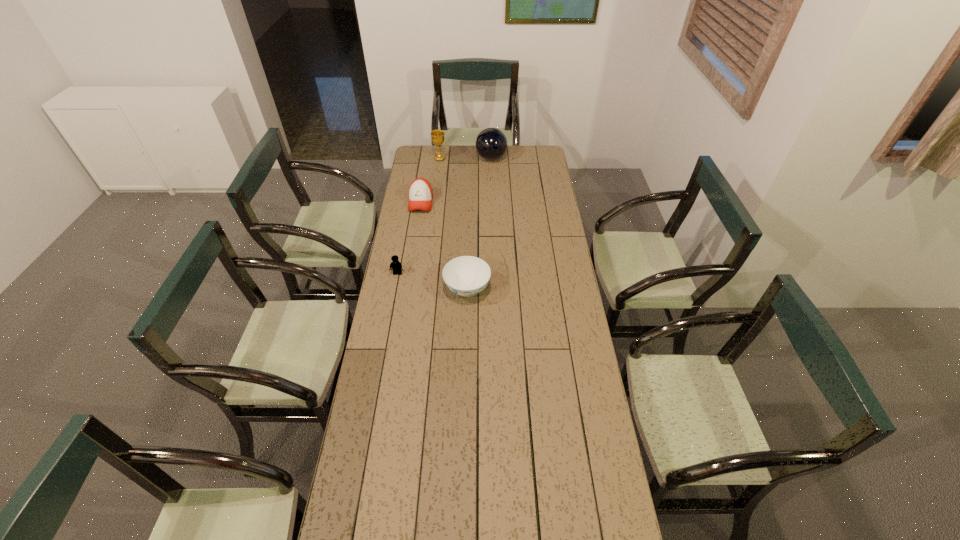
Image resolution: width=960 pixels, height=540 pixels. I want to click on free region at the right edge of the desktop, so click(x=576, y=524).

Find the location of `free location at the far right corner`. free location at the far right corner is located at coordinates (520, 157).

Locate an element on the screen. The width and height of the screenshot is (960, 540). free space between the Lego and the chalice is located at coordinates (419, 216).

The height and width of the screenshot is (540, 960). Find the location of `free point between the Lego and the chinaware`. free point between the Lego and the chinaware is located at coordinates click(432, 281).

Image resolution: width=960 pixels, height=540 pixels. What are the coordinates of `free space between the chalice and the Lego` in the screenshot? It's located at (419, 216).

This screenshot has width=960, height=540. Identify the location of unoccupied position between the Lego and the chalice. (419, 216).

The height and width of the screenshot is (540, 960). In order to click on blank region between the third nearest object and the Lego in this screenshot , I will do `click(409, 238)`.

This screenshot has width=960, height=540. I want to click on vacant region between the chinaware and the Lego, so click(x=432, y=281).

Identify which object is the nearest to the chinaware. Please provide its 2D coordinates. Your answer should be formatted as a tuple, i.e. [(x, y)], where the tuple contains the x and y coordinates of a point satisfying the conditions above.

[(396, 266)]

This screenshot has width=960, height=540. In order to click on the fourth closest object to the bowling ball in this screenshot , I will do `click(396, 266)`.